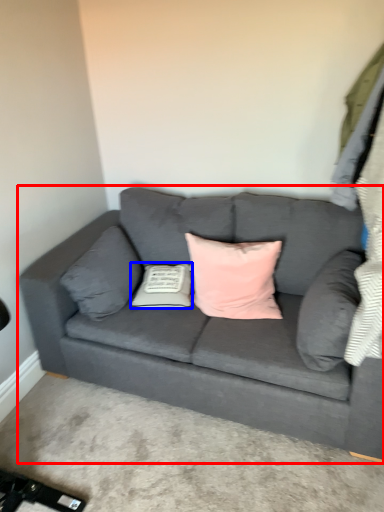
Question: Which point is closer to the camera, studio couch (highlighted by a red box) or pillow (highlighted by a blue box)?

Choices:
 (A) studio couch
 (B) pillow

Answer: (A)